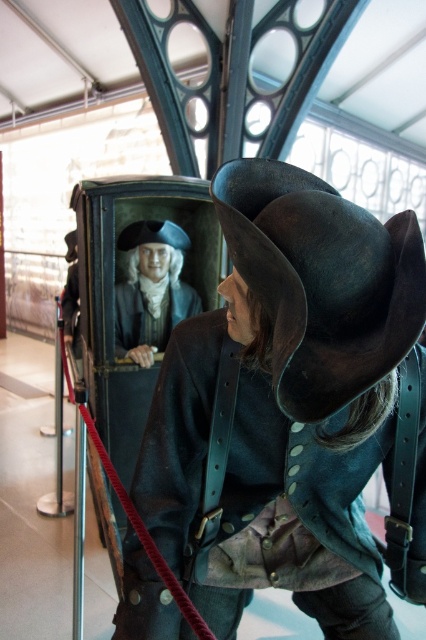
You are a visitor standing in front of the display. You want to touch the dark brown leather hat at center. Is the display case tall enough for you to reach it?

The dark brown leather hat at center is 22.59 inches away from you, so if your arm can reach 22.59 inches, you can touch it.

Based on the photo, you are standing in the museum and want to take a photo of the matte black bust at upper center. The museum has a rule that you must stand exactly at point (150, 289) to take the photo. Can you confirm the exact coordinates where you should stand?

Yes, you should stand exactly at point (150, 289) to take the photo of the matte black bust at upper center as specified by the museum.

You are a visitor in the museum and want to take a photo of both the point at (132, 244) and the point at (118, 241). If you stand in a position where you can see both points clearly, which point will appear closer to the camera in your photo?

Point at (132, 244) will appear closer to the camera because it is in front of point at (118, 241).